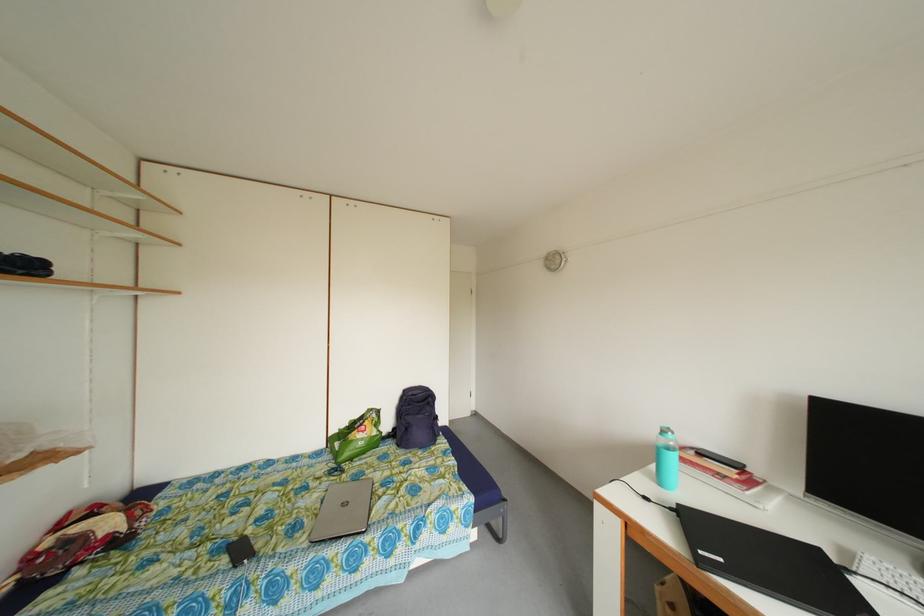
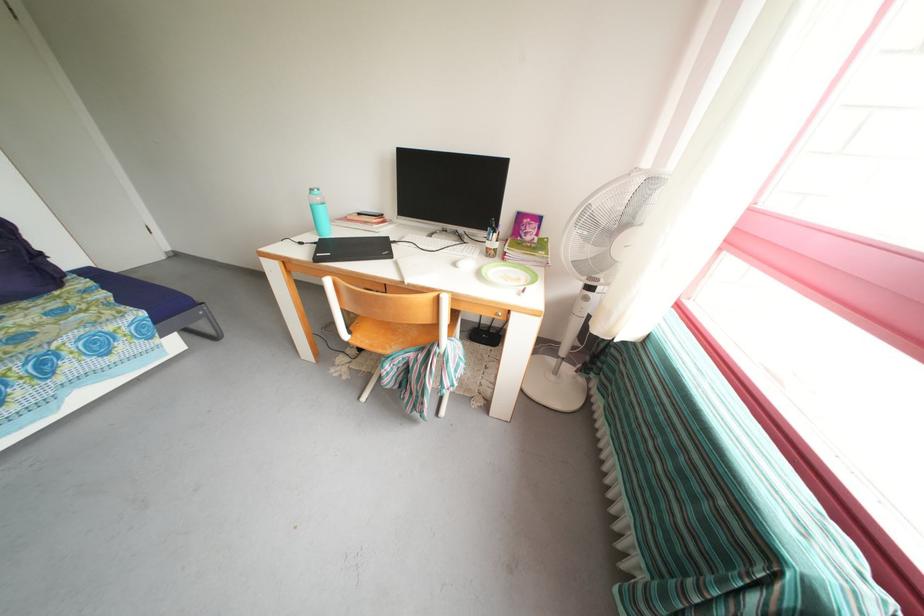
How did the camera likely rotate?

The rotation direction of the camera is right-down.